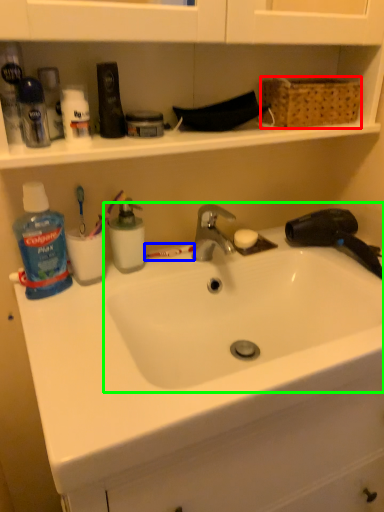
Question: Which is nearer to the basket (highlighted by a red box)? toothbrush (highlighted by a blue box) or sink (highlighted by a green box).

Choices:
 (A) toothbrush
 (B) sink

Answer: (B)